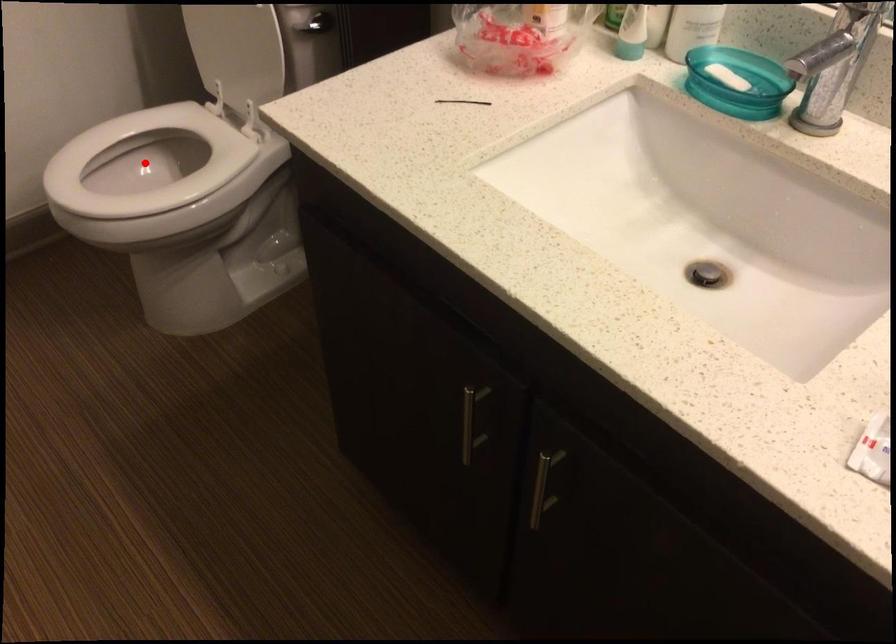
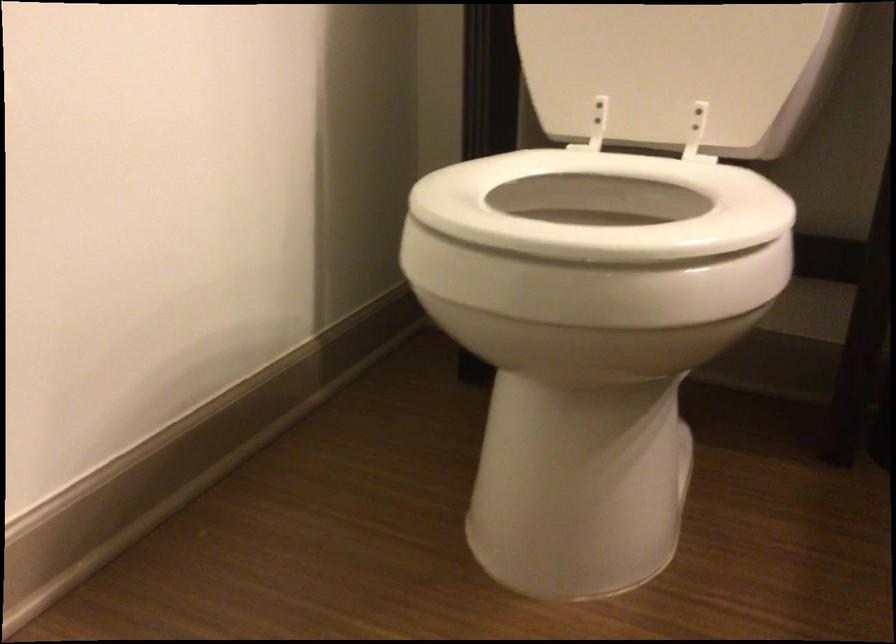
Question: I am providing you with two images of the same scene from different viewpoints. A red point is marked on the first image. At the location where the point appears in image 1, is it still visible in image 2?

Choices:
 (A) Yes
 (B) No

Answer: (B)